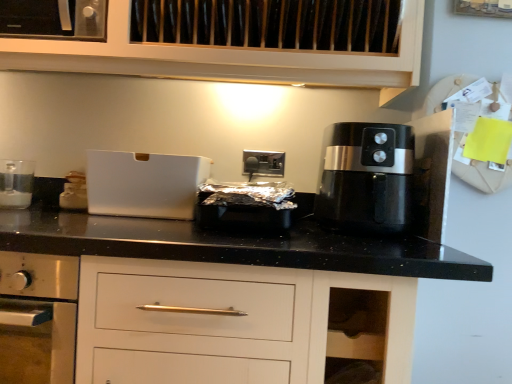
Question: Is the depth of black plastic air fryer at right greater than that of satin silver outlet at center?

Choices:
 (A) no
 (B) yes

Answer: (A)

Question: From a real-world perspective, does black plastic air fryer at right sit lower than satin silver outlet at center?

Choices:
 (A) yes
 (B) no

Answer: (A)

Question: Can you confirm if black plastic air fryer at right is thinner than satin silver outlet at center?

Choices:
 (A) yes
 (B) no

Answer: (B)

Question: Would you say black plastic air fryer at right is a long distance from satin silver outlet at center?

Choices:
 (A) yes
 (B) no

Answer: (B)

Question: Considering the relative sizes of black plastic air fryer at right and satin silver outlet at center in the image provided, is black plastic air fryer at right wider than satin silver outlet at center?

Choices:
 (A) no
 (B) yes

Answer: (B)

Question: Considering the positions of satin silver outlet at center and white matte box at center in the image, is satin silver outlet at center bigger or smaller than white matte box at center?

Choices:
 (A) big
 (B) small

Answer: (B)

Question: Considering their positions, is satin silver outlet at center located in front of or behind white matte box at center?

Choices:
 (A) front
 (B) behind

Answer: (B)

Question: Which is correct: satin silver outlet at center is inside white matte box at center, or outside of it?

Choices:
 (A) inside
 (B) outside

Answer: (B)

Question: Is point (273, 175) positioned closer to the camera than point (138, 195)?

Choices:
 (A) farther
 (B) closer

Answer: (A)

Question: From the image's perspective, relative to clear glass at left, which is counted as the first kitchen appliance, starting from the left, is satin silver outlet at center above or below?

Choices:
 (A) above
 (B) below

Answer: (A)

Question: In terms of height, does satin silver outlet at center look taller or shorter compared to clear glass at left, which is counted as the first kitchen appliance, starting from the left?

Choices:
 (A) short
 (B) tall

Answer: (A)

Question: Looking at their shapes, would you say satin silver outlet at center is wider or thinner than clear glass at left, which is counted as the first kitchen appliance, starting from the left?

Choices:
 (A) thin
 (B) wide

Answer: (A)

Question: Looking at the image, does satin silver outlet at center seem bigger or smaller compared to clear glass at left, arranged as the second kitchen appliance when viewed from the right?

Choices:
 (A) big
 (B) small

Answer: (B)

Question: Is point (372, 172) closer or farther from the camera than point (30, 182)?

Choices:
 (A) farther
 (B) closer

Answer: (B)

Question: Considering their positions, is black plastic air fryer at right located in front of or behind clear glass at left, which is counted as the first kitchen appliance, starting from the left?

Choices:
 (A) behind
 (B) front

Answer: (B)